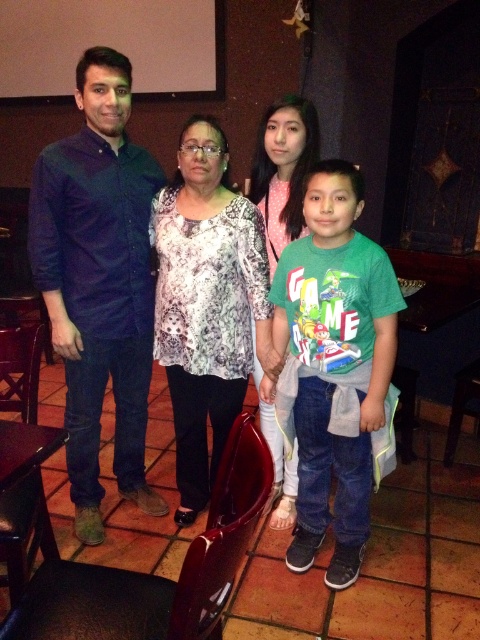
You are a photographer trying to capture a group photo of the green cotton shirt at center and the pink dotted blouse at center. Which one is lower in the frame?

The green cotton shirt at center is positioned under the pink dotted blouse at center, so it is lower in the frame.

You are a photographer taking a picture of the group. You notice two people wearing shirts at the center of the image. Which one is lower in position between the green cotton shirt at center and the printed fabric blouse at center?

The green cotton shirt at center is lower than the printed fabric blouse at center, so the green cotton shirt at center is lower in position.

You are at a clothing store and see two shirts displayed side by side. The green cotton shirt at center and the pink dotted blouse at center. Which one has a larger size?

The green cotton shirt at center is bigger than the pink dotted blouse at center, so the green cotton shirt at center has a larger size.